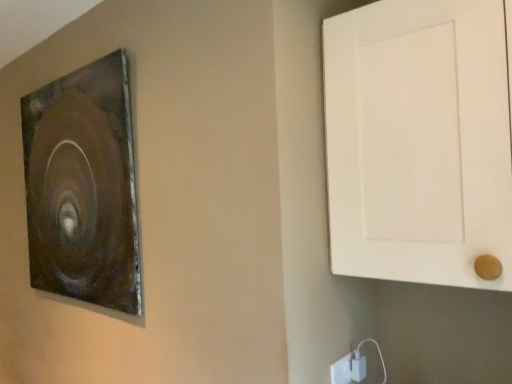
Question: Based on their positions, is metallic brown picture frame at upper left located to the left or right of white matte door at right?

Choices:
 (A) left
 (B) right

Answer: (A)

Question: Does point (36, 182) appear closer or farther from the camera than point (390, 31)?

Choices:
 (A) closer
 (B) farther

Answer: (B)

Question: Which object is the farthest from the white matte door at right?

Choices:
 (A) white plastic electric outlet at lower right
 (B) metallic brown picture frame at upper left

Answer: (B)

Question: Based on their relative distances, which object is farther from the white plastic electric outlet at lower right?

Choices:
 (A) metallic brown picture frame at upper left
 (B) white matte door at right

Answer: (A)